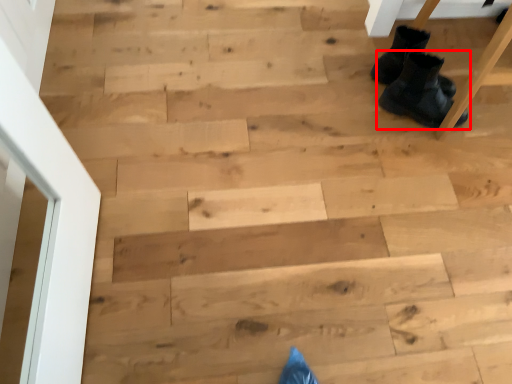
Question: Observing the image, what is the correct spatial positioning of footwear (annotated by the red box) in reference to footwear?

Choices:
 (A) right
 (B) left

Answer: (A)